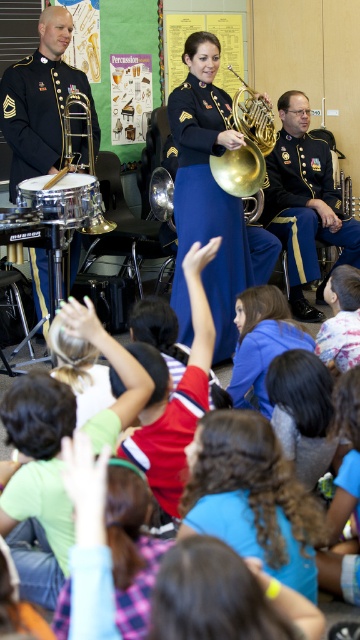
You are a photographer standing at the location of the camera. You want to take a photo of the shiny gold french horn at center. Is the distance between you and the horn sufficient to capture a clear, non distorted image with your standard zoom lens?

The shiny gold french horn at center and camera are 3.59 meters apart. With a standard zoom lens, this distance is sufficient to capture a clear, non distorted image of the shiny gold french horn at center.

You are a student sitting in the classroom and want to look at both point (183, 472) and point (317, 472). Which point will appear larger to you?

Point (183, 472) is closer to the camera than point (317, 472), so it will appear larger.

You are a student sitting at the back of the classroom. You want to look at the curly brown hair at center. Where should you look?

You should look towards the center of the classroom, where the curly brown hair at center is located at point (253, 497).